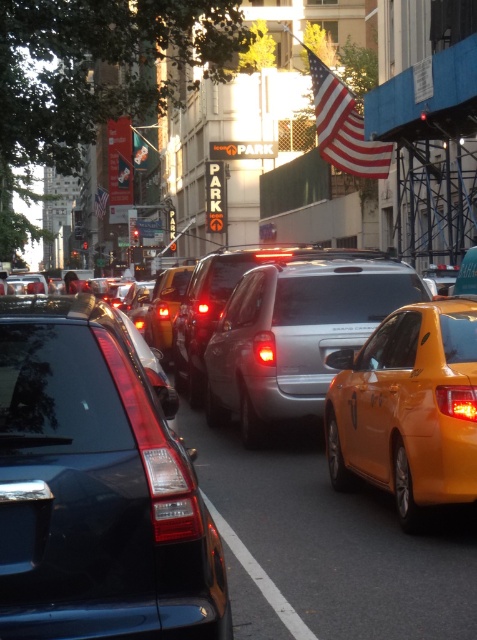
You are standing on the sidewalk observing the traffic jam. There are two points marked on the road ahead of you. The first point is at coordinates point (10,358), and the second is at point (283,600). Which point is closer to your current position?

Point (10,358) is closer to the camera than point (283,600), so the first point is closer to your current position.

You are a pedestrian standing at the point marked by the coordinates point (165, 308). What object are you standing on?

The point (165, 308) corresponds to the yellow matte taxi at center, so you are standing on the yellow matte taxi at center.

Looking at this image, you are a pedestrian standing at the edge of the street. You see a satin silver van at center and a white rubber line at center. Which object is higher from the ground?

The satin silver van at center is taller than the white rubber line at center.